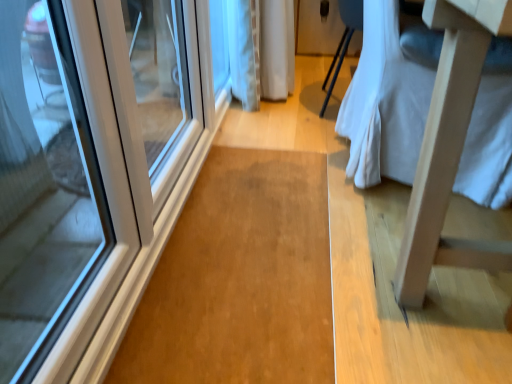
What do you see at coordinates (153, 94) in the screenshot? I see `white glossy door at left` at bounding box center [153, 94].

This screenshot has width=512, height=384. Identify the location of white glossy door at left. (153, 94).

This screenshot has width=512, height=384. What do you see at coordinates (449, 147) in the screenshot? I see `light wood changing table at right` at bounding box center [449, 147].

Where is `light wood changing table at right`? light wood changing table at right is located at coordinates click(x=449, y=147).

What is the approximate height of light wood changing table at right?

The height of light wood changing table at right is 74.44 centimeters.

This screenshot has height=384, width=512. Identify the location of white glossy door at left. tap(153, 94).

Is light wood changing table at right at the right side of white glossy door at left?

Yes, light wood changing table at right is to the right of white glossy door at left.

Is the position of light wood changing table at right more distant than that of white glossy door at left?

No.

Considering the positions of points (431, 106) and (168, 50), is point (431, 106) closer to camera compared to point (168, 50)?

Yes, point (431, 106) is in front of point (168, 50).

From the image's perspective, would you say light wood changing table at right is positioned over white glossy door at left?

Yes, from the image's perspective, light wood changing table at right is over white glossy door at left.

From a real-world perspective, between light wood changing table at right and white glossy door at left, who is vertically higher?

light wood changing table at right.

Which of these two, light wood changing table at right or white glossy door at left, is thinner?

white glossy door at left is thinner.

Is light wood changing table at right taller than white glossy door at left?

Yes.

In terms of size, does light wood changing table at right appear bigger or smaller than white glossy door at left?

Clearly, light wood changing table at right is larger in size than white glossy door at left.

Do you think light wood changing table at right is within white glossy door at left, or outside of it?

light wood changing table at right is outside white glossy door at left.

Consider the image. Is light wood changing table at right far away from white glossy door at left?

light wood changing table at right is far away from white glossy door at left.

Does light wood changing table at right turn towards white glossy door at left?

No.

Image resolution: width=512 pixels, height=384 pixels. Find the location of `door behind the light wood changing table at right`. door behind the light wood changing table at right is located at coordinates (153, 94).

Visually, is white glossy door at left positioned to the left or to the right of light wood changing table at right?

white glossy door at left is positioned on light wood changing table at right's left side.

Considering the positions of objects white glossy door at left and light wood changing table at right in the image provided, who is behind, white glossy door at left or light wood changing table at right?

white glossy door at left is further from the camera.

Does point (134, 148) come closer to viewer compared to point (394, 287)?

That is True.

From the image's perspective, is white glossy door at left above or below light wood changing table at right?

white glossy door at left is below light wood changing table at right.

From a real-world perspective, does white glossy door at left stand above light wood changing table at right?

No, from a real-world perspective, white glossy door at left is not on top of light wood changing table at right.

Considering the relative sizes of white glossy door at left and light wood changing table at right in the image provided, is white glossy door at left thinner than light wood changing table at right?

Correct, the width of white glossy door at left is less than that of light wood changing table at right.

Considering the sizes of white glossy door at left and light wood changing table at right in the image, is white glossy door at left taller or shorter than light wood changing table at right?

In the image, white glossy door at left appears to be shorter than light wood changing table at right.

Can you confirm if white glossy door at left is bigger than light wood changing table at right?

Incorrect, white glossy door at left is not larger than light wood changing table at right.

Is white glossy door at left situated inside light wood changing table at right or outside?

white glossy door at left is not inside light wood changing table at right, it's outside.

Is white glossy door at left directly adjacent to light wood changing table at right?

No.

In the scene shown: Is white glossy door at left positioned with its back to light wood changing table at right?

No, white glossy door at left is not facing the opposite direction of light wood changing table at right.

How different are the orientations of white glossy door at left and light wood changing table at right in degrees?

white glossy door at left and light wood changing table at right are facing 2.65 degrees away from each other.

Where is `changing table lying on the right of white glossy door at left`? The image size is (512, 384). changing table lying on the right of white glossy door at left is located at coordinates (449, 147).

This screenshot has width=512, height=384. What are the coordinates of `door below the light wood changing table at right (from the image's perspective)` in the screenshot? It's located at (153, 94).

Where is `door beneath the light wood changing table at right (from a real-world perspective)`? The height and width of the screenshot is (384, 512). door beneath the light wood changing table at right (from a real-world perspective) is located at coordinates (153, 94).